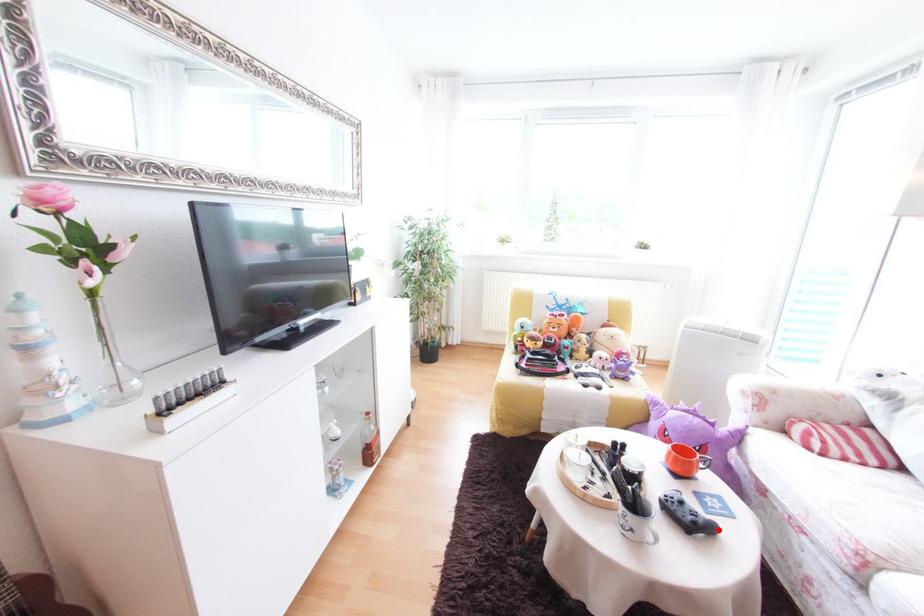
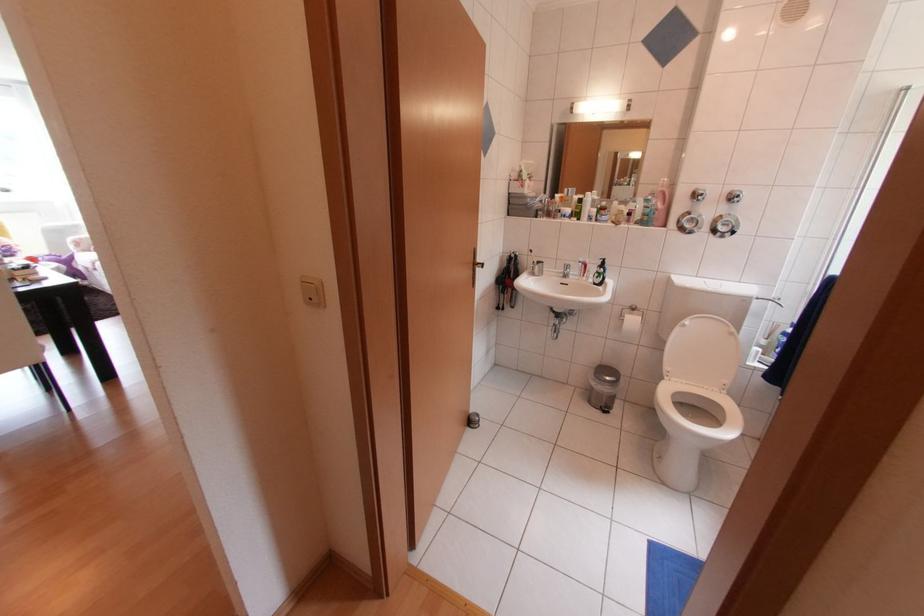
Question: I am providing you with two images of the same scene from different viewpoints. A red point is marked on the first image. Can you still see the location of the red point in image 2?

Choices:
 (A) Yes
 (B) No

Answer: (B)